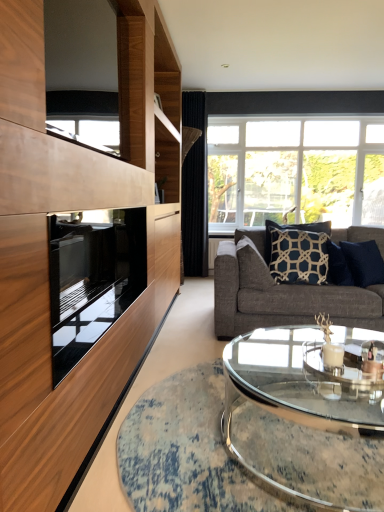
Question: Does dark blue textured pillow at center right, the 1th pillow from the right, have a larger size compared to clear glass window at upper right?

Choices:
 (A) yes
 (B) no

Answer: (B)

Question: Is dark blue textured pillow at center right, arranged as the 3th pillow when viewed from the left, positioned beyond the bounds of clear glass window at upper right?

Choices:
 (A) yes
 (B) no

Answer: (A)

Question: Is dark blue textured pillow at center right, arranged as the 3th pillow when viewed from the left, in contact with clear glass window at upper right?

Choices:
 (A) yes
 (B) no

Answer: (B)

Question: Does dark blue textured pillow at center right, arranged as the 3th pillow when viewed from the left, have a smaller size compared to clear glass window at upper right?

Choices:
 (A) yes
 (B) no

Answer: (A)

Question: Could you tell me if dark blue textured pillow at center right, arranged as the 3th pillow when viewed from the left, is facing clear glass window at upper right?

Choices:
 (A) no
 (B) yes

Answer: (A)

Question: Is the position of dark blue textured pillow at center right, arranged as the 3th pillow when viewed from the left, less distant than that of clear glass window at upper right?

Choices:
 (A) no
 (B) yes

Answer: (B)

Question: Is dark gray fabric couch at center completely or partially inside dark blue textured pillow at center, the 1th pillow from the left?

Choices:
 (A) yes
 (B) no

Answer: (B)

Question: From a real-world perspective, is dark blue textured pillow at center, which is the 3th pillow in right-to-left order, positioned under dark gray fabric couch at center based on gravity?

Choices:
 (A) yes
 (B) no

Answer: (B)

Question: Is dark blue textured pillow at center, the 1th pillow from the left, facing away from dark gray fabric couch at center?

Choices:
 (A) no
 (B) yes

Answer: (B)

Question: Is dark blue textured pillow at center, the 1th pillow from the left, facing towards dark gray fabric couch at center?

Choices:
 (A) no
 (B) yes

Answer: (B)

Question: Considering the relative sizes of dark blue textured pillow at center, which is the 3th pillow in right-to-left order, and dark gray fabric couch at center in the image provided, is dark blue textured pillow at center, which is the 3th pillow in right-to-left order, shorter than dark gray fabric couch at center?

Choices:
 (A) no
 (B) yes

Answer: (B)

Question: Can you confirm if dark blue textured pillow at center, the 1th pillow from the left, is thinner than dark gray fabric couch at center?

Choices:
 (A) yes
 (B) no

Answer: (A)

Question: Considering the relative sizes of dark blue textured pillow at center, the 1th pillow from the left, and black velvet curtain at center in the image provided, is dark blue textured pillow at center, the 1th pillow from the left, shorter than black velvet curtain at center?

Choices:
 (A) yes
 (B) no

Answer: (A)